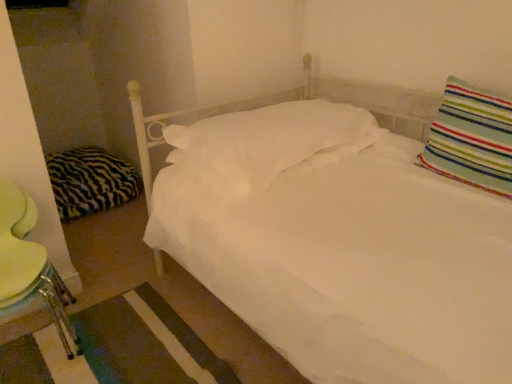
Question: Considering the positions of striped fabric pillow at upper right, which appears as the third pillow when viewed from the left, and metallic green swivel chair at lower left in the image, is striped fabric pillow at upper right, which appears as the third pillow when viewed from the left, taller or shorter than metallic green swivel chair at lower left?

Choices:
 (A) short
 (B) tall

Answer: (A)

Question: From a real-world perspective, relative to metallic green swivel chair at lower left, is striped fabric pillow at upper right, which appears as the third pillow when viewed from the left, vertically above or below?

Choices:
 (A) above
 (B) below

Answer: (A)

Question: Which of these objects is positioned farthest from the striped fabric pillow at upper right, the first pillow when ordered from right to left?

Choices:
 (A) zebra-patterned fabric pillow at left, marked as the 3th pillow in a front-to-back arrangement
 (B) white soft pillow at center, which ranks as the second pillow in right-to-left order
 (C) metallic green swivel chair at lower left

Answer: (A)

Question: Considering the real-world distances, which object is farthest from the metallic green swivel chair at lower left?

Choices:
 (A) zebra-patterned fabric pillow at left, the third pillow in the right-to-left sequence
 (B) striped fabric pillow at upper right, the first pillow when ordered from right to left
 (C) white soft pillow at center, placed as the 2th pillow when sorted from left to right

Answer: (B)